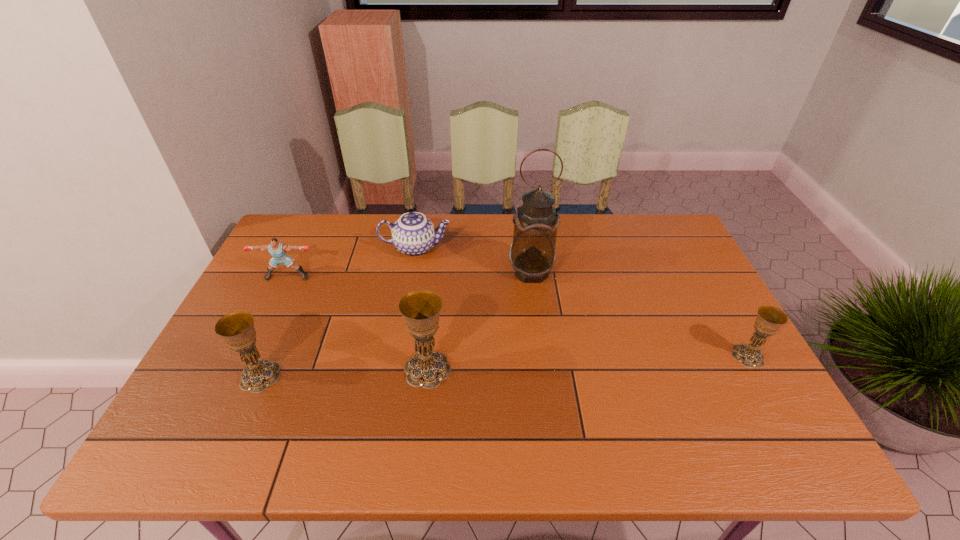
Where is `free space located 0.120m on the back of the second tallest chalice`? Image resolution: width=960 pixels, height=540 pixels. free space located 0.120m on the back of the second tallest chalice is located at coordinates (283, 324).

The image size is (960, 540). In order to click on vacant region located 0.340m on the back of the tallest chalice in this screenshot , I will do `click(439, 265)`.

This screenshot has height=540, width=960. I want to click on blank area located on the left of the shortest chalice, so click(x=682, y=356).

Find the location of a particular element. The image size is (960, 540). vacant region located 0.210m from the spout of the chinaware is located at coordinates [516, 248].

Where is `vacant space located 0.360m on the front-facing side of the puncher`? vacant space located 0.360m on the front-facing side of the puncher is located at coordinates (236, 382).

At what (x,y) coordinates should I click in order to perform the action: click on free space located 0.370m on the right of the second object from right to left. Please return your answer as a coordinate pair (x, y). The width and height of the screenshot is (960, 540). Looking at the image, I should click on (674, 272).

At what (x,y) coordinates should I click in order to perform the action: click on object that is positioned at the far edge. Please return your answer as a coordinate pair (x, y). The image size is (960, 540). Looking at the image, I should click on (413, 234).

Find the location of a particular element. Image resolution: width=960 pixels, height=540 pixels. chalice that is at the left edge is located at coordinates (237, 329).

The height and width of the screenshot is (540, 960). Identify the location of puncher located in the left edge section of the desktop. (277, 249).

Identify the location of object present at the right edge. The height and width of the screenshot is (540, 960). (769, 319).